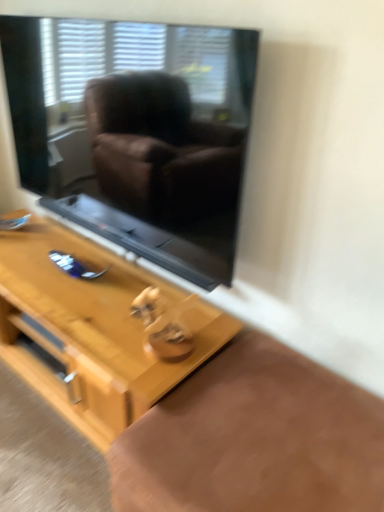
Question: Is light wood table at center smaller than black glass window screen at upper center?

Choices:
 (A) yes
 (B) no

Answer: (B)

Question: Is light wood table at center facing towards black glass window screen at upper center?

Choices:
 (A) yes
 (B) no

Answer: (B)

Question: Does light wood table at center lie in front of black glass window screen at upper center?

Choices:
 (A) yes
 (B) no

Answer: (B)

Question: From a real-world perspective, is light wood table at center physically below black glass window screen at upper center?

Choices:
 (A) yes
 (B) no

Answer: (A)

Question: Is light wood table at center to the left of black glass window screen at upper center from the viewer's perspective?

Choices:
 (A) yes
 (B) no

Answer: (A)

Question: From a real-world perspective, is light wood table at center positioned over black glass window screen at upper center based on gravity?

Choices:
 (A) yes
 (B) no

Answer: (B)

Question: Is black glass window screen at upper center oriented towards light wood table at center?

Choices:
 (A) no
 (B) yes

Answer: (A)

Question: Can you confirm if black glass window screen at upper center is taller than light wood table at center?

Choices:
 (A) yes
 (B) no

Answer: (A)

Question: From the image's perspective, would you say black glass window screen at upper center is positioned over light wood table at center?

Choices:
 (A) no
 (B) yes

Answer: (B)

Question: Is black glass window screen at upper center positioned in front of light wood table at center?

Choices:
 (A) no
 (B) yes

Answer: (B)

Question: Is light wood table at center surrounded by black glass window screen at upper center?

Choices:
 (A) no
 (B) yes

Answer: (A)

Question: Is the surface of black glass window screen at upper center in direct contact with light wood table at center?

Choices:
 (A) no
 (B) yes

Answer: (A)

Question: From the image's perspective, is light wood table at center positioned above or below black glass window screen at upper center?

Choices:
 (A) above
 (B) below

Answer: (B)